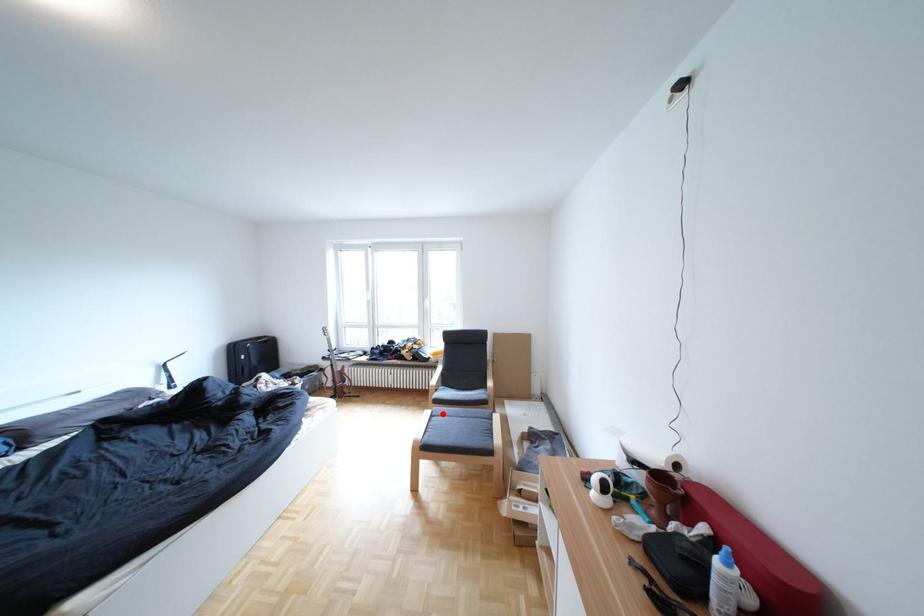
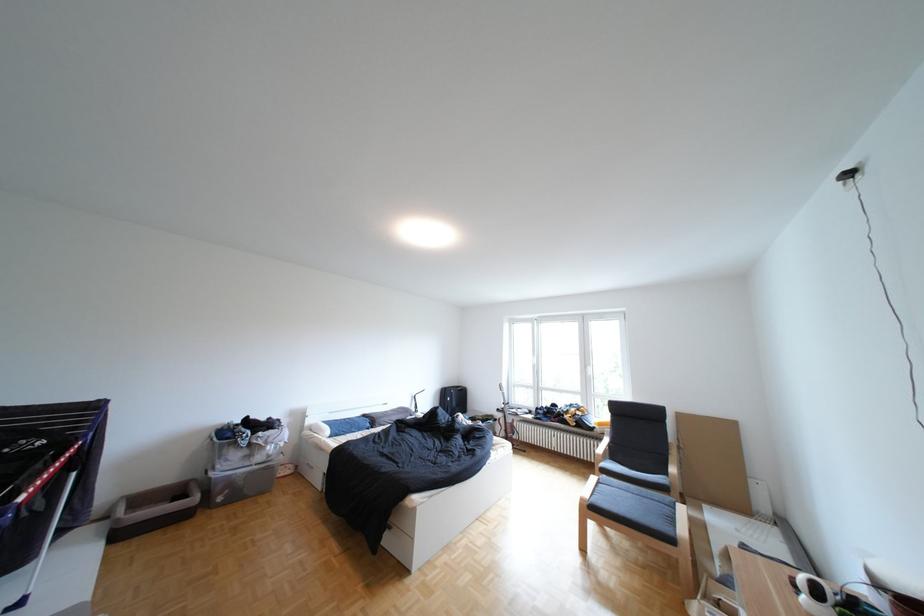
In the second image, find the point that corresponds to the highlighted location in the first image.

(610, 479)